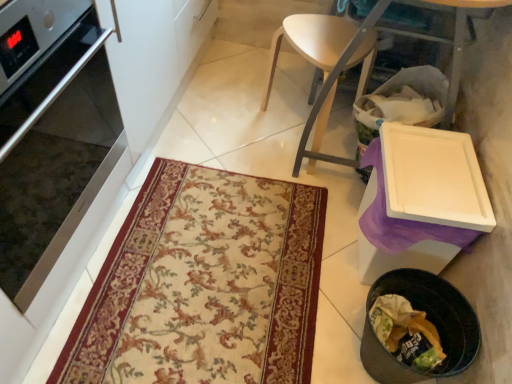
Find the location of a particular element. vacant region to the right of satin silver oven at left is located at coordinates (182, 269).